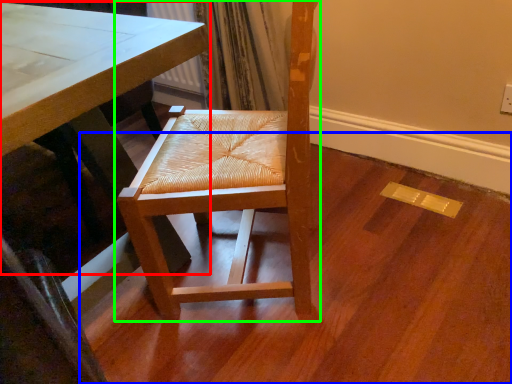
Question: Estimate the real-world distances between objects in this image. Which object is farther from table (highlighted by a red box), plywood (highlighted by a blue box) or chair (highlighted by a green box)?

Choices:
 (A) plywood
 (B) chair

Answer: (A)